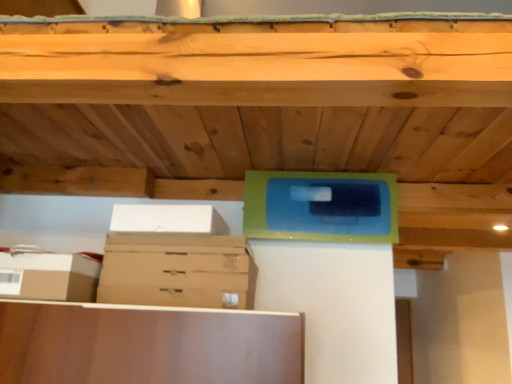
You are a GUI agent. You are given a task and a screenshot of the screen. Output one action in this format:
    pyautogui.click(x=<x>, y=<y>)
    Task: Click on the brown cardboard drawer at center
    Image resolution: width=512 pixels, height=384 pixels.
    Given the screenshot: What is the action you would take?
    pyautogui.click(x=176, y=270)

The height and width of the screenshot is (384, 512). In order to click on white cardboard box at upper left, the 1th storage box from the top in this screenshot , I will do `click(167, 219)`.

From their relative heights in the image, would you say brown cardboard box at lower left, which appears as the 2th storage box when viewed from the top, is taller or shorter than brown cardboard drawer at center?

Considering their sizes, brown cardboard box at lower left, which appears as the 2th storage box when viewed from the top, has more height than brown cardboard drawer at center.

Based on the photo, is brown cardboard drawer at center at the back of brown cardboard box at lower left, the first storage box in the bottom-to-top sequence?

That's not correct — brown cardboard box at lower left, the first storage box in the bottom-to-top sequence, is not looking away from brown cardboard drawer at center.

Consider the image. From a real-world perspective, who is located higher, brown cardboard box at lower left, which appears as the second storage box when viewed from the right, or brown cardboard drawer at center?

In real-world perspective, brown cardboard drawer at center is above.

Between brown cardboard box at lower left, which appears as the 2th storage box when viewed from the top, and brown cardboard drawer at center, which one has larger size?

brown cardboard drawer at center.

Is brown cardboard drawer at center closer to camera compared to white cardboard box at upper left, the 1th storage box in the right-to-left sequence?

No, it is behind white cardboard box at upper left, the 1th storage box in the right-to-left sequence.

Who is taller, brown cardboard drawer at center or white cardboard box at upper left, arranged as the 2th storage box when viewed from the left?

white cardboard box at upper left, arranged as the 2th storage box when viewed from the left.

Is brown cardboard drawer at center completely or partially outside of white cardboard box at upper left, arranged as the 2th storage box when viewed from the left?

brown cardboard drawer at center is positioned outside white cardboard box at upper left, arranged as the 2th storage box when viewed from the left.

From a real-world perspective, is brown cardboard drawer at center located beneath brown cardboard box at lower left, which appears as the second storage box when viewed from the right?

No, from a real-world perspective, brown cardboard drawer at center is not beneath brown cardboard box at lower left, which appears as the second storage box when viewed from the right.

How distant is brown cardboard drawer at center from brown cardboard box at lower left, which appears as the 2th storage box when viewed from the top?

brown cardboard drawer at center and brown cardboard box at lower left, which appears as the 2th storage box when viewed from the top, are 9.26 inches apart from each other.

Between brown cardboard drawer at center and brown cardboard box at lower left, the first storage box viewed from the left, which one has less height?

Standing shorter between the two is brown cardboard drawer at center.

Between point (182, 268) and point (19, 279), which one is positioned in front?

Positioned in front is point (19, 279).

Is white cardboard box at upper left, the second storage box positioned from the bottom, positioned far away from brown cardboard box at lower left, the first storage box viewed from the left?

white cardboard box at upper left, the second storage box positioned from the bottom, is near brown cardboard box at lower left, the first storage box viewed from the left, not far away.

Looking at this image, considering the sizes of objects white cardboard box at upper left, the second storage box positioned from the bottom, and brown cardboard box at lower left, the first storage box viewed from the left, in the image provided, who is bigger, white cardboard box at upper left, the second storage box positioned from the bottom, or brown cardboard box at lower left, the first storage box viewed from the left,?

white cardboard box at upper left, the second storage box positioned from the bottom.

From a real-world perspective, is white cardboard box at upper left, the second storage box positioned from the bottom, above or below brown cardboard box at lower left, which appears as the 2th storage box when viewed from the top?

white cardboard box at upper left, the second storage box positioned from the bottom, is above brown cardboard box at lower left, which appears as the 2th storage box when viewed from the top.

From the picture: Can you confirm if brown cardboard box at lower left, which appears as the second storage box when viewed from the right, is taller than white cardboard box at upper left, the second storage box positioned from the bottom?

No.

From the image's perspective, between brown cardboard box at lower left, which appears as the second storage box when viewed from the right, and white cardboard box at upper left, the 1th storage box in the right-to-left sequence, who is located below?

brown cardboard box at lower left, which appears as the second storage box when viewed from the right.

Is brown cardboard box at lower left, the first storage box viewed from the left, beside white cardboard box at upper left, the 1th storage box from the top?

brown cardboard box at lower left, the first storage box viewed from the left, and white cardboard box at upper left, the 1th storage box from the top, are not in contact.

From a real-world perspective, which is physically below, brown cardboard box at lower left, which appears as the second storage box when viewed from the right, or white cardboard box at upper left, the second storage box positioned from the bottom?

brown cardboard box at lower left, which appears as the second storage box when viewed from the right, is physically lower.

Starting from the brown cardboard drawer at center, which storage box is the 1st one to the left? Please provide its 2D coordinates.

[(167, 219)]

From the image's perspective, is white cardboard box at upper left, the 1th storage box in the right-to-left sequence, beneath brown cardboard drawer at center?

Incorrect, from the image's perspective, white cardboard box at upper left, the 1th storage box in the right-to-left sequence, is higher than brown cardboard drawer at center.

Locate an element on the screen. Image resolution: width=512 pixels, height=384 pixels. the 2nd storage box in front of the brown cardboard drawer at center, counting from the anchor's position is located at coordinates (49, 277).

Locate an element on the screen. Image resolution: width=512 pixels, height=384 pixels. drawer below the white cardboard box at upper left, the second storage box positioned from the bottom (from a real-world perspective) is located at coordinates [176, 270].

Which object lies nearer to the anchor point brown cardboard box at lower left, which appears as the 2th storage box when viewed from the top, brown cardboard drawer at center or white cardboard box at upper left, arranged as the 2th storage box when viewed from the left?

brown cardboard drawer at center is closer to brown cardboard box at lower left, which appears as the 2th storage box when viewed from the top.

Looking at this image, looking at the image, which one is located further to brown cardboard drawer at center, white cardboard box at upper left, the 1th storage box from the top, or brown cardboard box at lower left, which appears as the second storage box when viewed from the right?

Among the two, brown cardboard box at lower left, which appears as the second storage box when viewed from the right, is located further to brown cardboard drawer at center.

Estimate the real-world distances between objects in this image. Which object is closer to brown cardboard drawer at center, brown cardboard box at lower left, which appears as the second storage box when viewed from the right, or white cardboard box at upper left, arranged as the 2th storage box when viewed from the left?

white cardboard box at upper left, arranged as the 2th storage box when viewed from the left, is positioned closer to the anchor brown cardboard drawer at center.

When comparing their distances from brown cardboard box at lower left, the first storage box in the bottom-to-top sequence, does white cardboard box at upper left, the 1th storage box from the top, or brown cardboard drawer at center seem closer?

Among the two, brown cardboard drawer at center is located nearer to brown cardboard box at lower left, the first storage box in the bottom-to-top sequence.

Looking at the image, which one is located further to white cardboard box at upper left, arranged as the 2th storage box when viewed from the left, brown cardboard box at lower left, which appears as the 2th storage box when viewed from the top, or brown cardboard drawer at center?

brown cardboard box at lower left, which appears as the 2th storage box when viewed from the top, is positioned further to the anchor white cardboard box at upper left, arranged as the 2th storage box when viewed from the left.

Based on the photo, looking at the image, which one is located closer to white cardboard box at upper left, the 1th storage box from the top, brown cardboard drawer at center or brown cardboard box at lower left, which appears as the second storage box when viewed from the right?

brown cardboard drawer at center is closer to white cardboard box at upper left, the 1th storage box from the top.

Locate an element on the screen. This screenshot has width=512, height=384. storage box between brown cardboard box at lower left, which appears as the second storage box when viewed from the right, and brown cardboard drawer at center, in the horizontal direction is located at coordinates (167, 219).